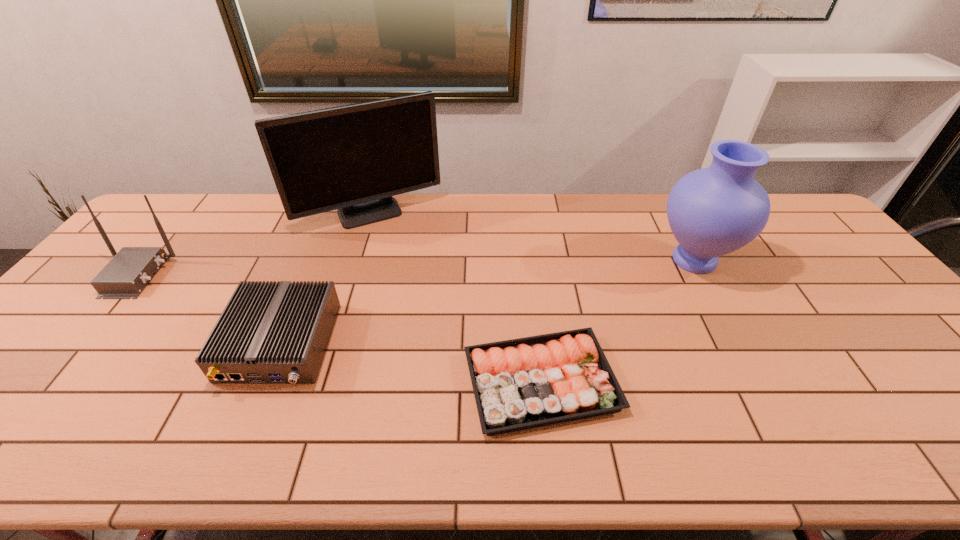
At what (x,y) coordinates should I click in order to perform the action: click on free space between the computer monitor and the farther router. Please return your answer as a coordinate pair (x, y). The width and height of the screenshot is (960, 540). Looking at the image, I should click on (253, 245).

Image resolution: width=960 pixels, height=540 pixels. Identify the location of object that is the second nearest to the farther router. (353, 158).

Identify which object is the third nearest to the left router. Please provide its 2D coordinates. Your answer should be formatted as a tuple, i.e. [(x, y)], where the tuple contains the x and y coordinates of a point satisfying the conditions above.

[(518, 384)]

This screenshot has height=540, width=960. In order to click on vacant area that satisfies the following two spatial constraints: 1. on the front-facing side of the shortest object; 2. on the right side of the computer monitor in this screenshot , I will do `click(319, 382)`.

The height and width of the screenshot is (540, 960). In order to click on free space that satisfies the following two spatial constraints: 1. on the back of the third tallest object to connect cables; 2. on the back side of the shortest object in this screenshot , I will do `click(46, 382)`.

The image size is (960, 540). What are the coordinates of `free spot that satisfies the following two spatial constraints: 1. on the back of the taller router to connect cables; 2. on the back side of the fourth object from left to right` in the screenshot? It's located at (46, 382).

The width and height of the screenshot is (960, 540). In order to click on vacant region that satisfies the following two spatial constraints: 1. on the back of the taller router to connect cables; 2. on the right side of the platter in this screenshot , I will do `click(46, 382)`.

You are a GUI agent. You are given a task and a screenshot of the screen. Output one action in this format:
    pyautogui.click(x=<x>, y=<y>)
    Task: Click on the vacant position in the image that satisfies the following two spatial constraints: 1. on the back panel of the shortest object; 2. on the left side of the fourth tallest object
    
    Given the screenshot: What is the action you would take?
    pyautogui.click(x=264, y=382)

At what (x,y) coordinates should I click in order to perform the action: click on free point that satisfies the following two spatial constraints: 1. on the front-facing side of the computer monitor; 2. on the back of the taller router to connect cables. Please return your answer as a coordinate pair (x, y). This screenshot has height=540, width=960. Looking at the image, I should click on (352, 275).

You are a GUI agent. You are given a task and a screenshot of the screen. Output one action in this format:
    pyautogui.click(x=<x>, y=<y>)
    Task: Click on the vacant space that satisfies the following two spatial constraints: 1. on the front-facing side of the shortest object; 2. on the left side of the computer monitor
    This screenshot has height=540, width=960.
    Given the screenshot: What is the action you would take?
    pyautogui.click(x=319, y=382)